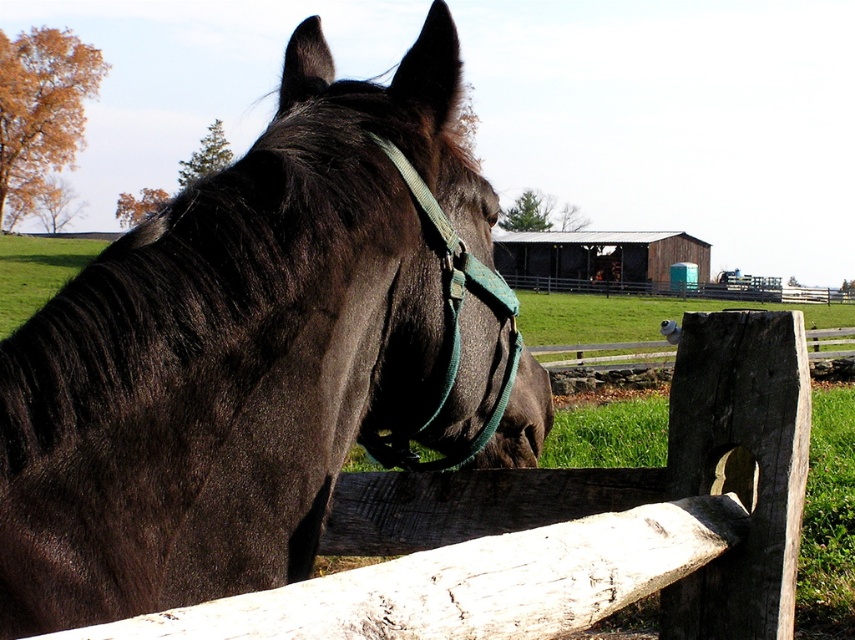
In the scene shown: Between shiny black horse at center and green fabric bridle at center, which one appears on the right side from the viewer's perspective?

green fabric bridle at center

Based on the photo, does shiny black horse at center appear on the right side of green fabric bridle at center?

Incorrect, shiny black horse at center is not on the right side of green fabric bridle at center.

Measure the distance between shiny black horse at center and camera.

shiny black horse at center and camera are 1.06 meters apart from each other.

The height and width of the screenshot is (640, 855). I want to click on shiny black horse at center, so click(x=248, y=353).